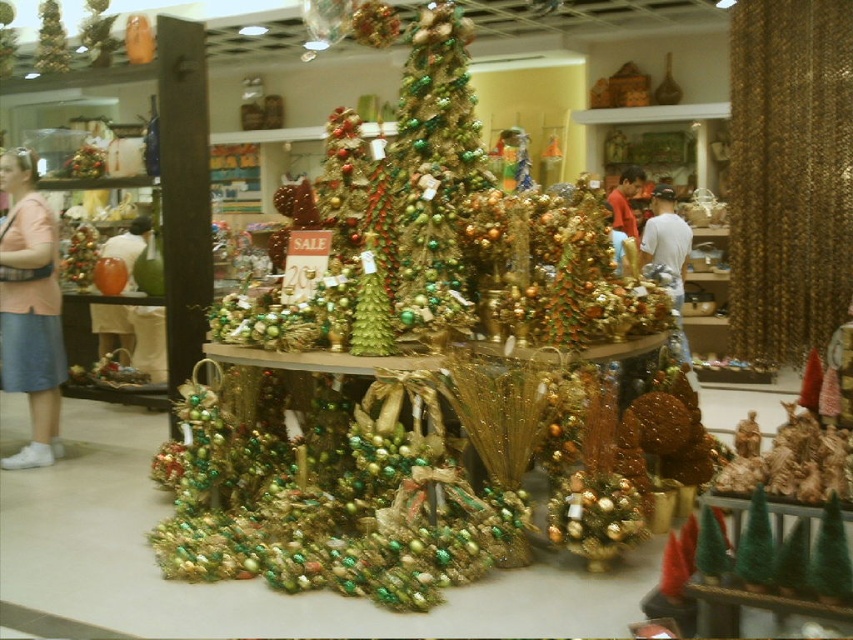
You are a store employee who needs to reach the pink fabric skirt at left to adjust its position. Your arms can extend 1.5 meters. Can you reach it without moving closer?

The pink fabric skirt at left is 3.95 meters away from the viewer. Since your arms can only extend 1.5 meters, you cannot reach it without moving closer.

You are a store employee arranging holiday decorations. You need to place a new ornament that requires 10 inches of space. The ornament must be placed between the green metallic christmas tree at center and the matte white vase at left. Is there enough space between them?

The green metallic christmas tree at center has a lesser width compared to matte white vase at left, so there is sufficient space between them to accommodate the 10 inches required for the new ornament.